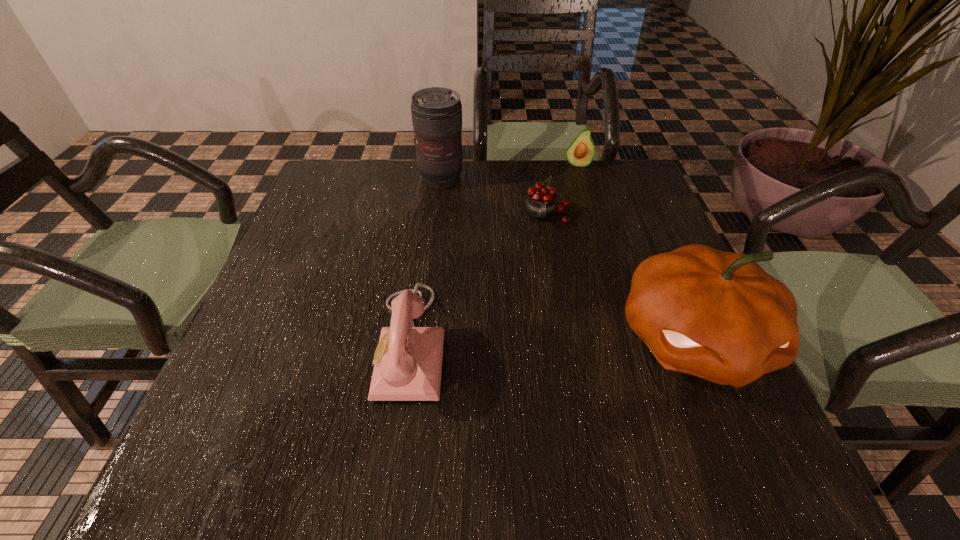
The image size is (960, 540). In order to click on vacant region at the far left corner of the desktop in this screenshot , I will do `click(337, 195)`.

The height and width of the screenshot is (540, 960). In the image, there is a desktop. Identify the location of vacant space at the far right corner. (646, 194).

Image resolution: width=960 pixels, height=540 pixels. I want to click on vacant space at the near right corner of the desktop, so click(732, 402).

You are a GUI agent. You are given a task and a screenshot of the screen. Output one action in this format:
    pyautogui.click(x=<x>, y=<y>)
    Task: Click on the vacant area between the telephoto lens and the pot filled with cherries
    This screenshot has width=960, height=540.
    Given the screenshot: What is the action you would take?
    pyautogui.click(x=494, y=197)

Image resolution: width=960 pixels, height=540 pixels. Identify the location of free space between the telephoto lens and the third tallest object. (426, 261).

This screenshot has width=960, height=540. I want to click on vacant area between the third shortest object and the pumpkin, so click(x=552, y=341).

The height and width of the screenshot is (540, 960). Identify the location of vacant point located between the telephone and the telephoto lens. (426, 261).

Image resolution: width=960 pixels, height=540 pixels. I want to click on free space that is in between the telephoto lens and the avocado, so click(509, 172).

You are a GUI agent. You are given a task and a screenshot of the screen. Output one action in this format:
    pyautogui.click(x=<x>, y=<y>)
    Task: Click on the unoccupied position between the pot filled with cherries and the telephoto lens
    The height and width of the screenshot is (540, 960).
    Given the screenshot: What is the action you would take?
    pyautogui.click(x=494, y=197)

This screenshot has height=540, width=960. Identify the location of free space between the telephoto lens and the pot filled with cherries. (494, 197).